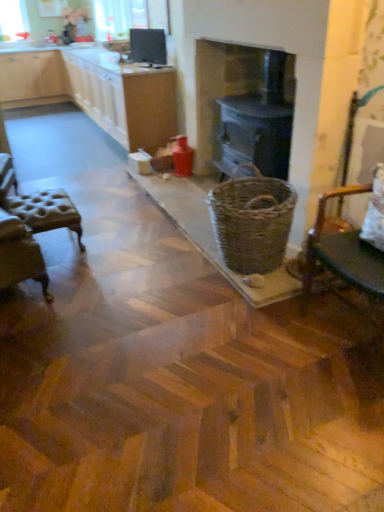
Question: From the image's perspective, is wooden chair at right, the 2th chair from the left, located beneath woven brown basket at center?

Choices:
 (A) no
 (B) yes

Answer: (B)

Question: Could you tell me if wooden chair at right, the first chair when ordered from right to left, is turned towards woven brown basket at center?

Choices:
 (A) no
 (B) yes

Answer: (A)

Question: Is wooden chair at right, which appears as the second chair when viewed from the back, positioned before woven brown basket at center?

Choices:
 (A) yes
 (B) no

Answer: (A)

Question: From the image's perspective, does wooden chair at right, which appears as the second chair when viewed from the back, appear higher than woven brown basket at center?

Choices:
 (A) yes
 (B) no

Answer: (B)

Question: Is wooden chair at right, placed as the 1th chair when sorted from front to back, directly adjacent to woven brown basket at center?

Choices:
 (A) yes
 (B) no

Answer: (B)

Question: Is wooden chair at right, the first chair when ordered from right to left, wider than woven brown basket at center?

Choices:
 (A) no
 (B) yes

Answer: (B)

Question: Does light wood cabinetry at upper left, placed as the second cabinetry when sorted from front to back, have a lesser height compared to white wood cabinets at upper left, which appears as the 1th cabinetry when viewed from the front?

Choices:
 (A) yes
 (B) no

Answer: (B)

Question: Is light wood cabinetry at upper left, the 1th cabinetry viewed from the back, smaller than white wood cabinets at upper left, the 2th cabinetry positioned from the back?

Choices:
 (A) yes
 (B) no

Answer: (A)

Question: Does light wood cabinetry at upper left, the 1th cabinetry viewed from the back, have a larger size compared to white wood cabinets at upper left, which appears as the 1th cabinetry when viewed from the front?

Choices:
 (A) no
 (B) yes

Answer: (A)

Question: Considering the relative positions of light wood cabinetry at upper left, the 1th cabinetry viewed from the back, and white wood cabinets at upper left, which appears as the 1th cabinetry when viewed from the front, in the image provided, is light wood cabinetry at upper left, the 1th cabinetry viewed from the back, to the right of white wood cabinets at upper left, which appears as the 1th cabinetry when viewed from the front, from the viewer's perspective?

Choices:
 (A) no
 (B) yes

Answer: (A)

Question: Could white wood cabinets at upper left, the 2th cabinetry positioned from the back, be considered to be inside light wood cabinetry at upper left, the 1th cabinetry viewed from the back?

Choices:
 (A) yes
 (B) no

Answer: (B)

Question: Is light wood cabinetry at upper left, the 1th cabinetry viewed from the back, wider than white wood cabinets at upper left, which appears as the 1th cabinetry when viewed from the front?

Choices:
 (A) yes
 (B) no

Answer: (B)

Question: Is matte black monitor at upper center behind wooden chair at right, the 2th chair from the left?

Choices:
 (A) yes
 (B) no

Answer: (A)